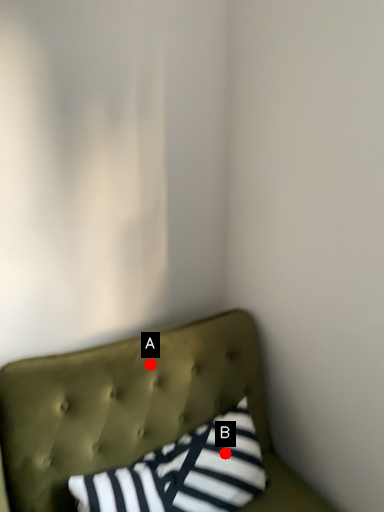
Question: Two points are circled on the image, labeled by A and B beside each circle. Which point appears farthest from the camera in this image?

Choices:
 (A) A is further
 (B) B is further

Answer: (A)